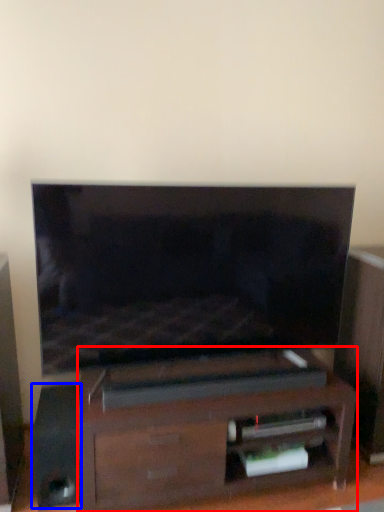
Question: Which object is closer to the camera taking this photo, furniture (highlighted by a red box) or speaker (highlighted by a blue box)?

Choices:
 (A) furniture
 (B) speaker

Answer: (A)